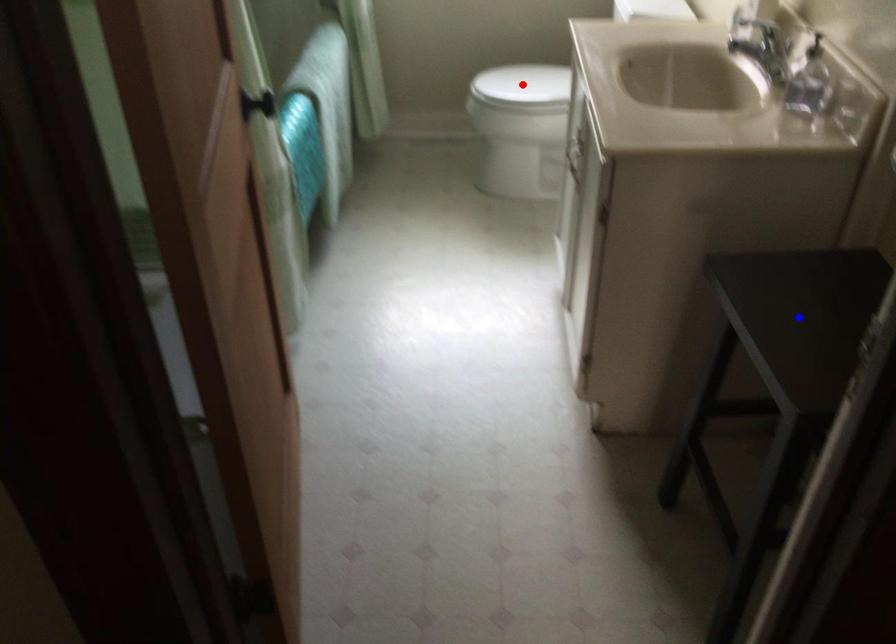
Question: Which of the two points in the image is closer to the camera?

Choices:
 (A) Blue point is closer.
 (B) Red point is closer.

Answer: (A)